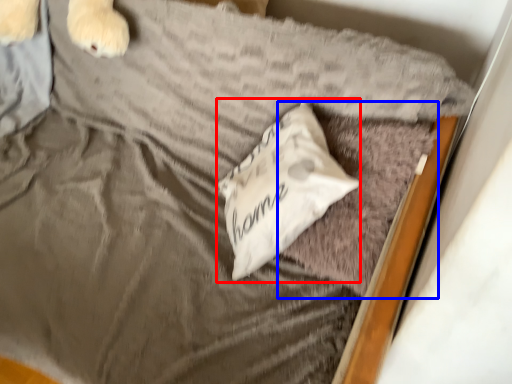
Question: Which of the following is the closest to the observer, pillow (highlighted by a red box) or pillow (highlighted by a blue box)?

Choices:
 (A) pillow
 (B) pillow

Answer: (B)